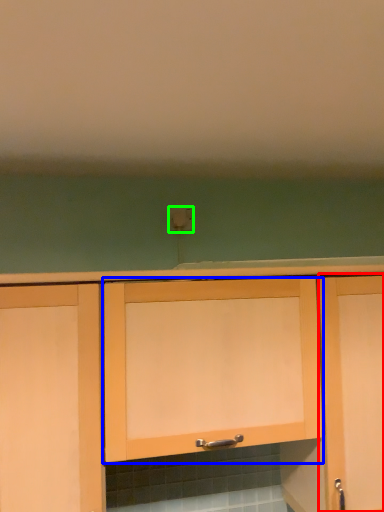
Question: Which object is positioned closest to cabinetry (highlighted by a red box)? Select from cabinetry (highlighted by a blue box) and electric outlet (highlighted by a green box).

Choices:
 (A) cabinetry
 (B) electric outlet

Answer: (A)